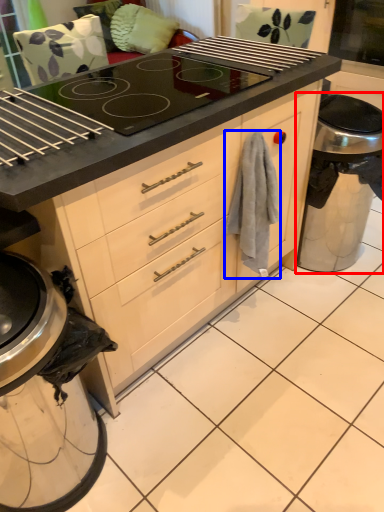
Question: Which point is further to the camera, appliance (highlighted by a red box) or material (highlighted by a blue box)?

Choices:
 (A) appliance
 (B) material

Answer: (A)